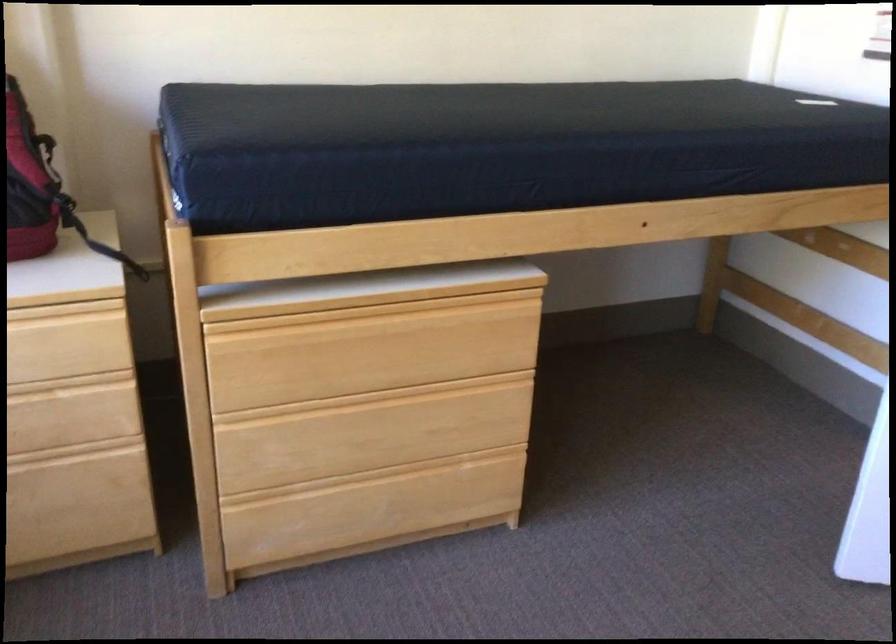
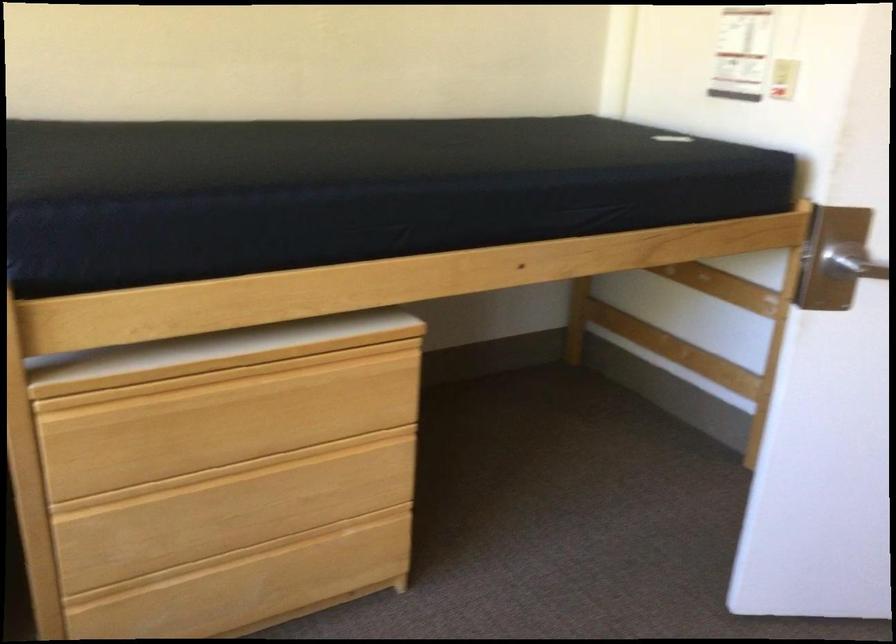
The point at (372, 474) is marked in the first image. Where is the corresponding point in the second image?

(238, 558)